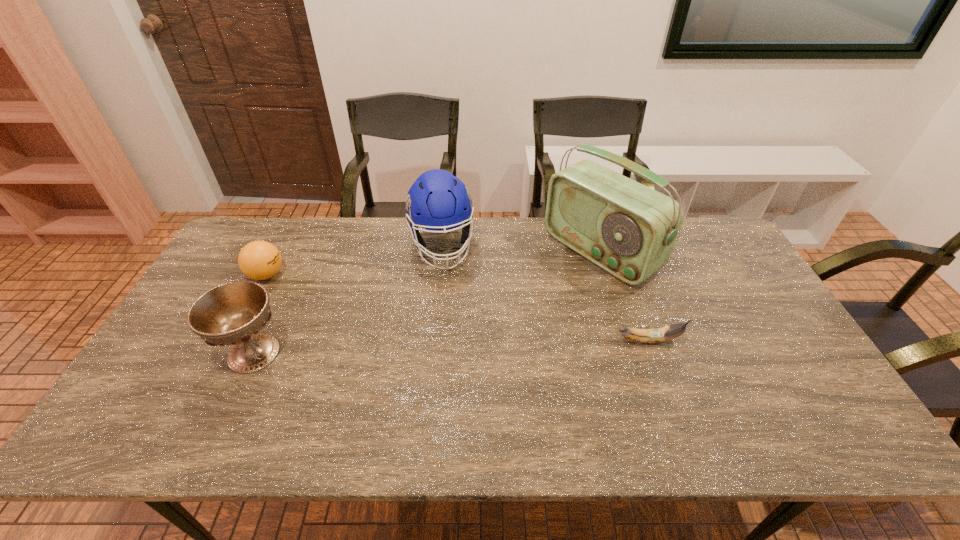
Locate an element on the screen. The image size is (960, 540). free space in the image that satisfies the following two spatial constraints: 1. on the front side of the second shortest object; 2. on the peel of the banana is located at coordinates (232, 340).